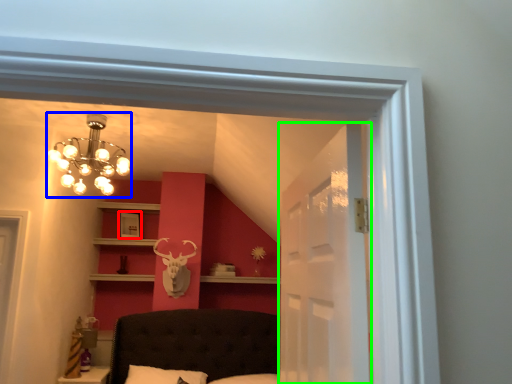
Question: Which object is the closest to the picture frame (highlighted by a red box)? Choose among these: lamp (highlighted by a blue box) or glass door (highlighted by a green box).

Choices:
 (A) lamp
 (B) glass door

Answer: (A)